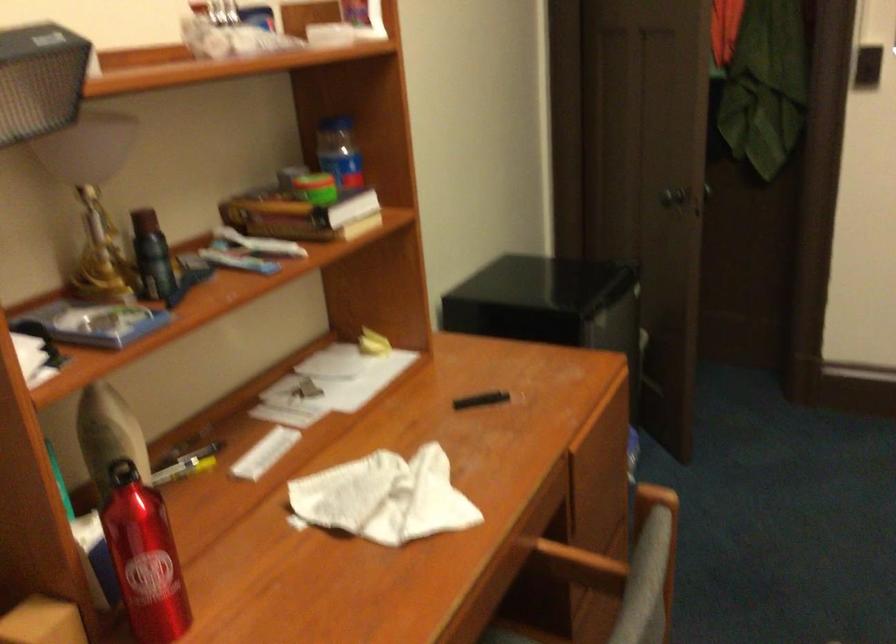
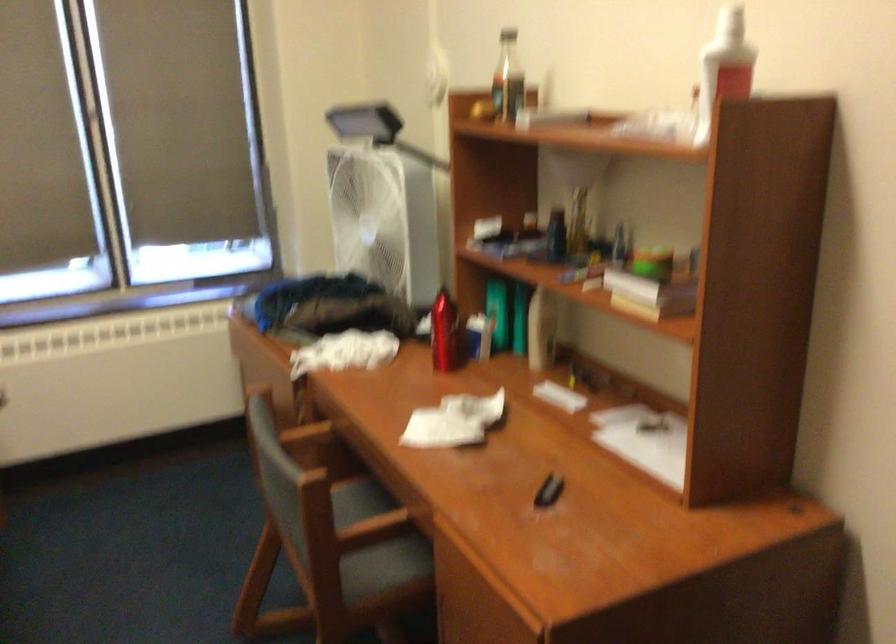
In the second image, find the point that corresponds to (x=583, y=574) in the first image.

(375, 545)